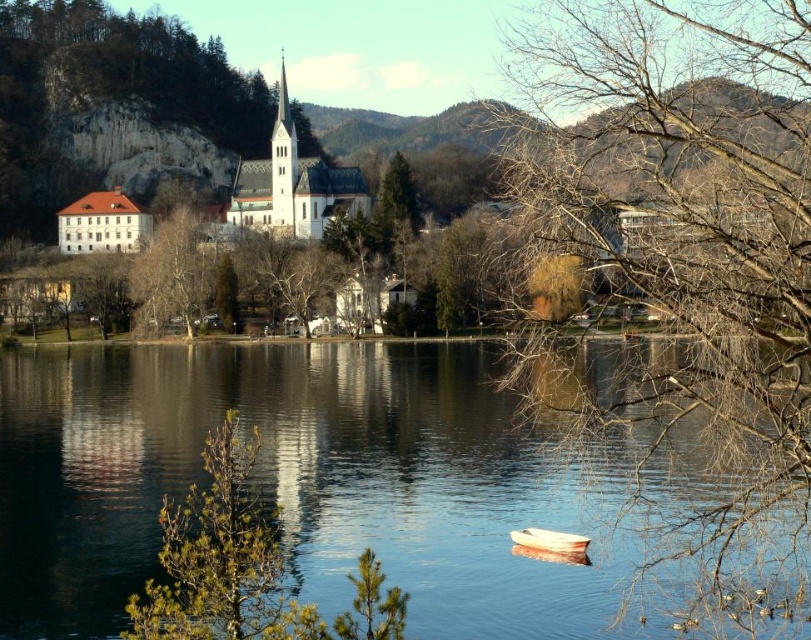
Question: Which object is the farthest from the clear water at lake center?

Choices:
 (A) white matte building at center
 (B) bare branches at center
 (C) green needle-like tree at center
 (D) white stone church at left

Answer: (D)

Question: Does white stone church at center appear on the left side of white matte building at center?

Choices:
 (A) no
 (B) yes

Answer: (A)

Question: Can you confirm if green needle-like tree at center is smaller than white stone church at left?

Choices:
 (A) yes
 (B) no

Answer: (A)

Question: Which point is closer to the camera?

Choices:
 (A) (117, 208)
 (B) (206, 593)
 (C) (548, 531)
 (D) (222, 317)

Answer: (B)

Question: Does clear water at lake center come behind white plastic boat at lower center?

Choices:
 (A) no
 (B) yes

Answer: (A)

Question: Which object is the closest to the green needle-like tree at center?

Choices:
 (A) green textured tree at center
 (B) white stone church at left

Answer: (A)